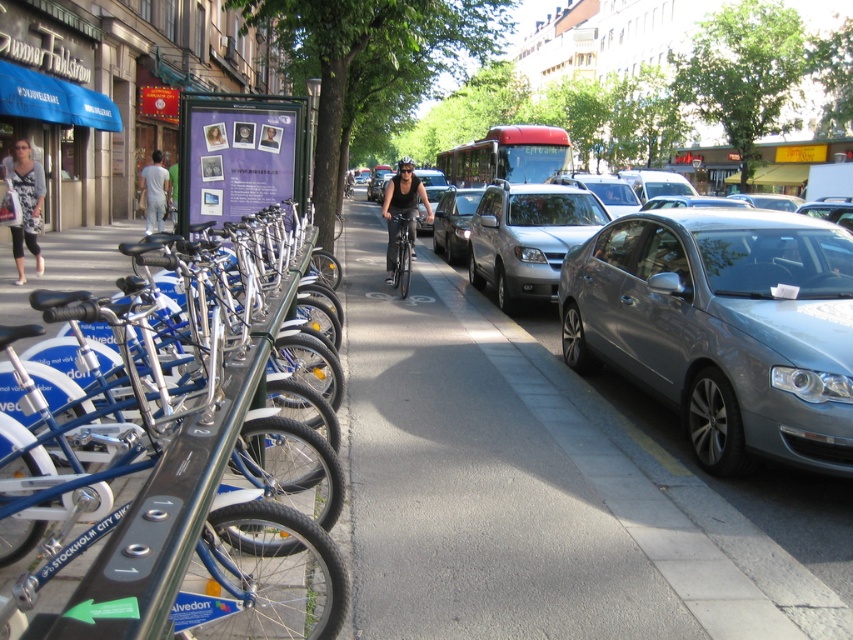
Is point (219, 371) positioned behind point (722, 461)?

No, it is in front of (722, 461).

Who is more forward, (193, 579) or (705, 460)?

Point (193, 579) is more forward.

Where is `blue metallic bicycle at left`? blue metallic bicycle at left is located at coordinates (196, 483).

Who is taller, gray asphalt pavement at center or silver metallic sedan at center?

silver metallic sedan at center is taller.

Who is more distant from viewer, (364,256) or (549,269)?

The point (364,256) is behind.

You are a GUI agent. You are given a task and a screenshot of the screen. Output one action in this format:
    pyautogui.click(x=<x>, y=<y>)
    Task: Click on the gray asphalt pavement at center
    Image resolution: width=853 pixels, height=640 pixels.
    Given the screenshot: What is the action you would take?
    pyautogui.click(x=541, y=490)

Does blue metallic bicycle at left lie behind shiny silver sedan at center?

No, it is not.

Does point (16, 492) come farther from viewer compared to point (444, 198)?

That is False.

Identify the location of blue metallic bicycle at left. The image size is (853, 640). (196, 483).